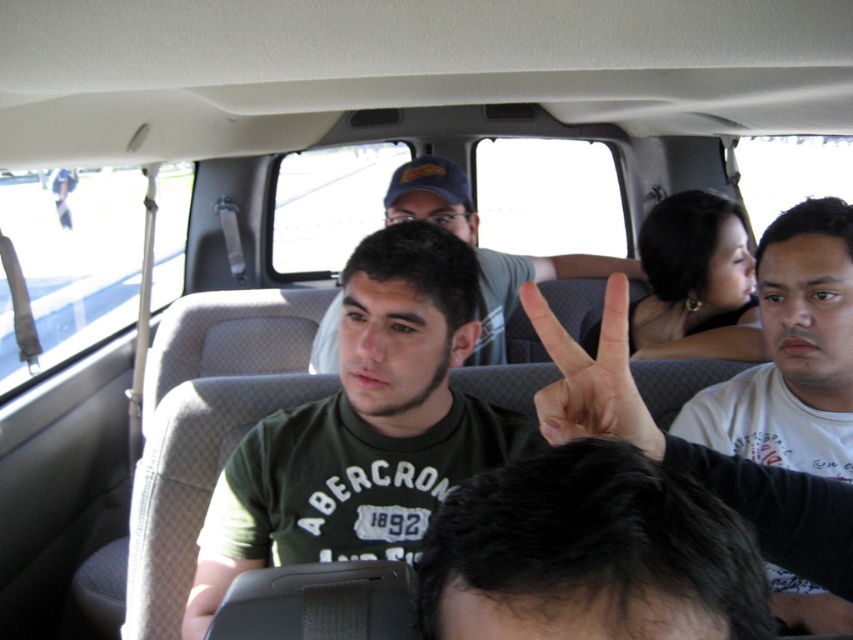
You are a photographer trying to capture a group photo of the passengers in the van. You notice the green matte shirt at center and the white cotton shirt at upper right. Based on their positions, which person might block the view of the other when taking the photo from the backseat perspective?

The green matte shirt at center might block the view of the white cotton shirt at upper right because it is wider and positioned closer to the camera.

You are a passenger sitting in the backseat of the vehicle and want to wave to someone outside using your right hand. The white cotton shirt at upper right and the white matte hand at center are in your line of sight. Which object would you need to move to ensure your hand is visible?

You need to move the white cotton shirt at upper right because it is positioned to the right of the white matte hand at center, blocking the view of your hand if it remains in that location.